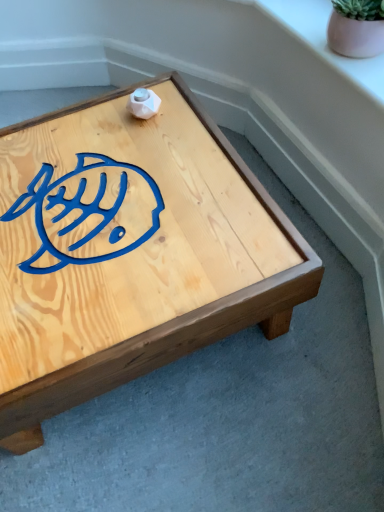
I want to click on free point above natural wood coffee table at center (from a real-world perspective), so click(135, 206).